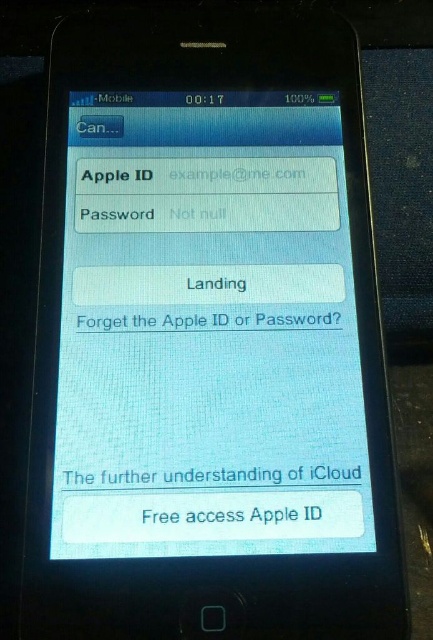
Question: Which of the following is the farthest from the observer?

Choices:
 (A) pos(288,317)
 (B) pos(119,522)
 (C) pos(316,266)

Answer: (C)

Question: Which is farther from the white matte text at bottom?

Choices:
 (A) white glossy screen at center
 (B) white paper text at center

Answer: (B)

Question: Is the position of white glossy screen at center less distant than that of white matte text at bottom?

Choices:
 (A) no
 (B) yes

Answer: (B)

Question: Does white glossy screen at center have a larger size compared to white matte text at bottom?

Choices:
 (A) no
 (B) yes

Answer: (B)

Question: Does white glossy screen at center have a lesser width compared to white paper text at center?

Choices:
 (A) no
 (B) yes

Answer: (A)

Question: Which point appears closest to the camera in this image?

Choices:
 (A) (259, 534)
 (B) (180, 321)
 (C) (196, 493)

Answer: (A)